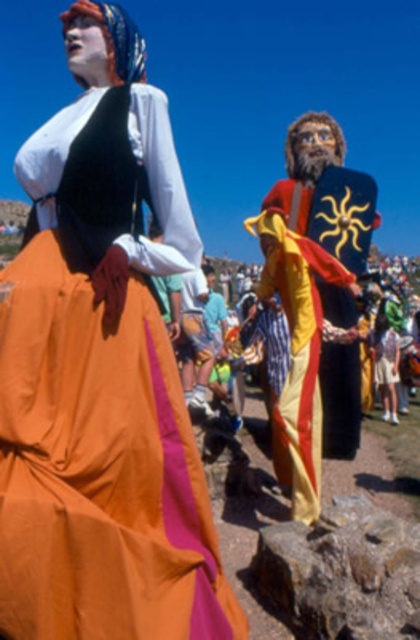
Looking at this image, you are a photographer planning to take a closeup shot of the matte orange skirt at center and the brown rough rock at lower center. Since you want both subjects to be clearly visible in the frame, which object should you focus on first to ensure clarity?

The matte orange skirt at center is larger in size than the brown rough rock at lower center, so you should focus on the matte orange skirt at center first to ensure clarity.